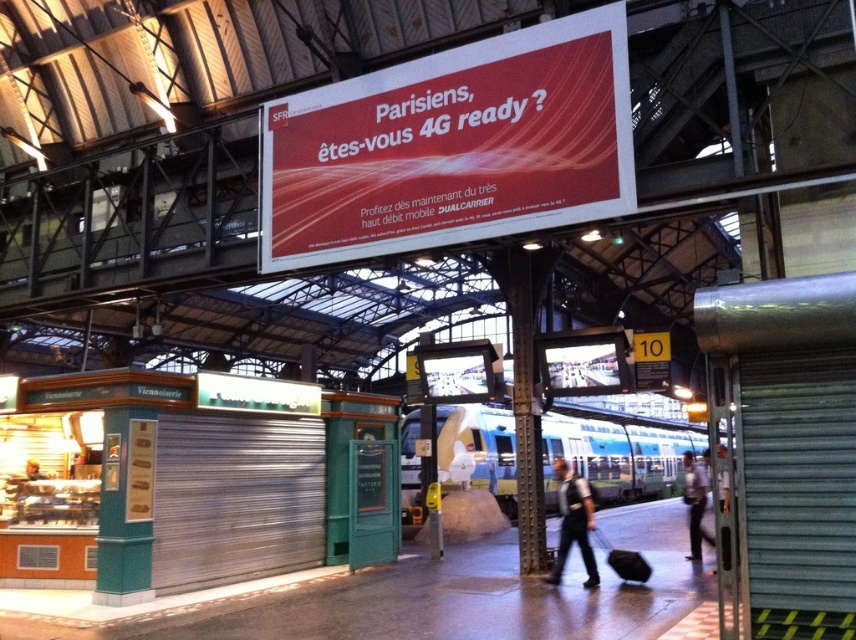
Question: Estimate the real-world distances between objects in this image. Which object is closer to the light blue metallic train at center?

Choices:
 (A) light blue shirt at right
 (B) dark blue uniform at center
 (C) matte red billboard at center

Answer: (A)

Question: Can you confirm if matte red billboard at center is smaller than dark blue uniform at center?

Choices:
 (A) yes
 (B) no

Answer: (A)

Question: Does matte red billboard at center appear over light blue metallic train at center?

Choices:
 (A) no
 (B) yes

Answer: (B)

Question: Which of the following is the farthest from the observer?

Choices:
 (A) (693, 481)
 (B) (574, 477)
 (C) (474, 467)
 (D) (539, 125)

Answer: (C)

Question: Which object appears farthest from the camera in this image?

Choices:
 (A) light blue metallic train at center
 (B) light blue shirt at right
 (C) dark blue uniform at center

Answer: (B)

Question: Is dark blue uniform at center above light blue shirt at right?

Choices:
 (A) yes
 (B) no

Answer: (A)